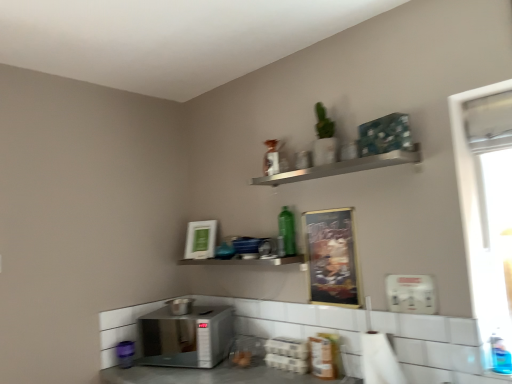
Where is `spots to the right of satin silver toaster at lower left, the 1th appliance in the left-to-right sequence`? spots to the right of satin silver toaster at lower left, the 1th appliance in the left-to-right sequence is located at coordinates (208, 312).